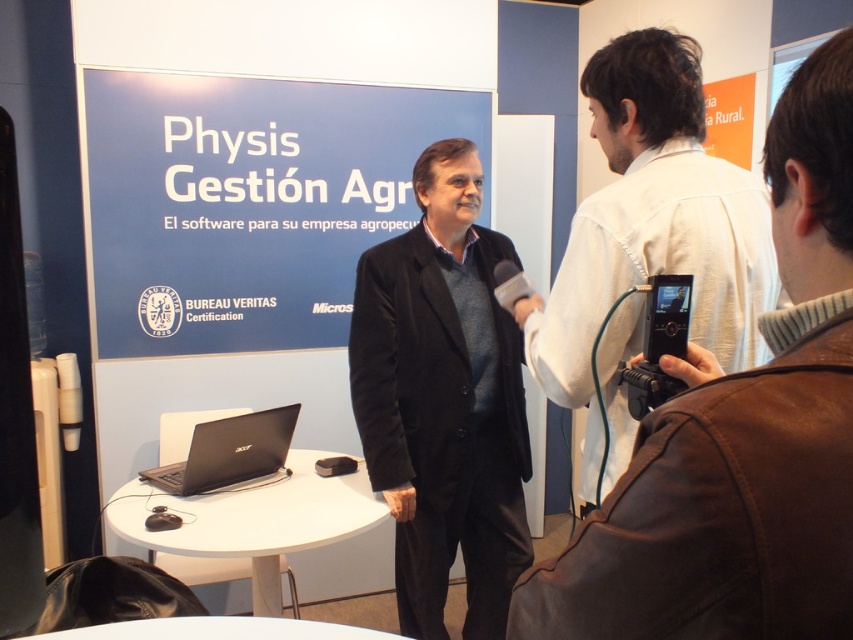
You are a photographer at the event and need to position a light to the left of the black velvet blazer at center. Will the light interfere with the black matte laptop at lower left?

The black velvet blazer at center is to the right of the black matte laptop at lower left, so placing the light to the left of the blazer would not interfere with the laptop as they are positioned in opposite directions.

You are a photographer at the event and need to adjust the lighting so that the black velvet blazer at center and white shirt at center are both visible. Which object should you focus on first to ensure proper exposure?

The white shirt at center should be focused on first because it is lighter in color and requires proper exposure to avoid overexposure, ensuring both the black velvet blazer at center and white shirt at center are visible.

Consider the image. You are standing at the trade show and want to take a photo of the banner. You notice two points on the banner labeled as point 1 and point 2. Point 1 is at coordinate (488, 614) and point 2 is at (173, 474). Which point is closer to you?

Point 1 at coordinate (488, 614) is closer to you than point 2 at (173, 474).